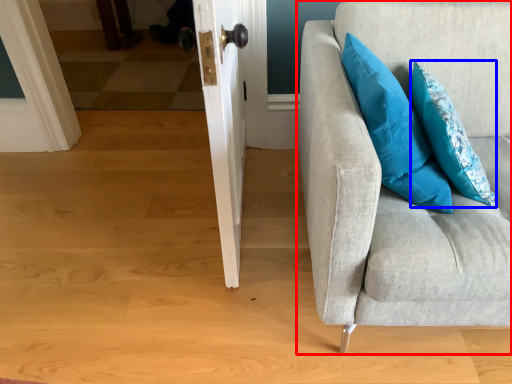
Question: Which point is closer to the camera, studio couch (highlighted by a red box) or pillow (highlighted by a blue box)?

Choices:
 (A) studio couch
 (B) pillow

Answer: (A)